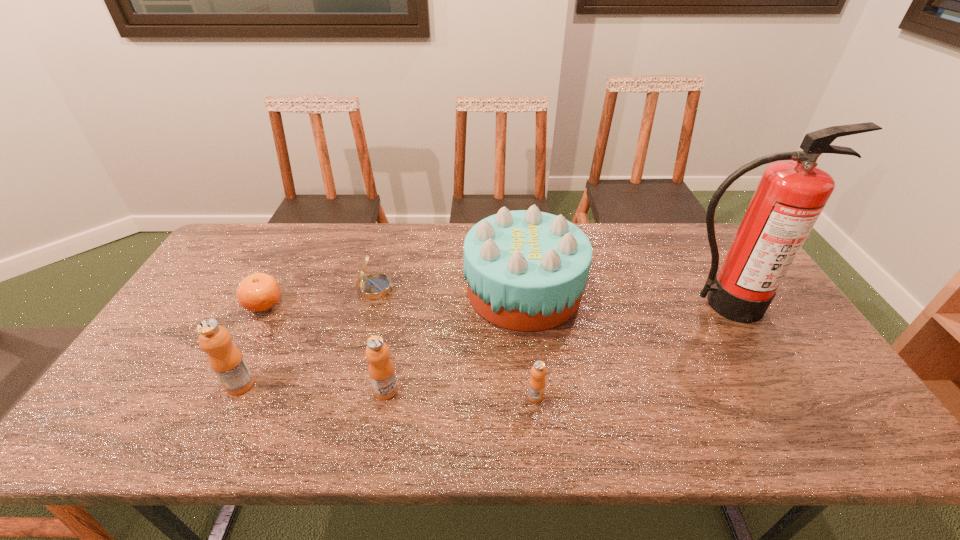
Given the evenly spaced orange juices in the image, where should an extra orange juice be added on the right to preserve the spacing? Please point to a vacant space. Please provide its 2D coordinates. Your answer should be formatted as a tuple, i.e. [(x, y)], where the tuple contains the x and y coordinates of a point satisfying the conditions above.

[(688, 402)]